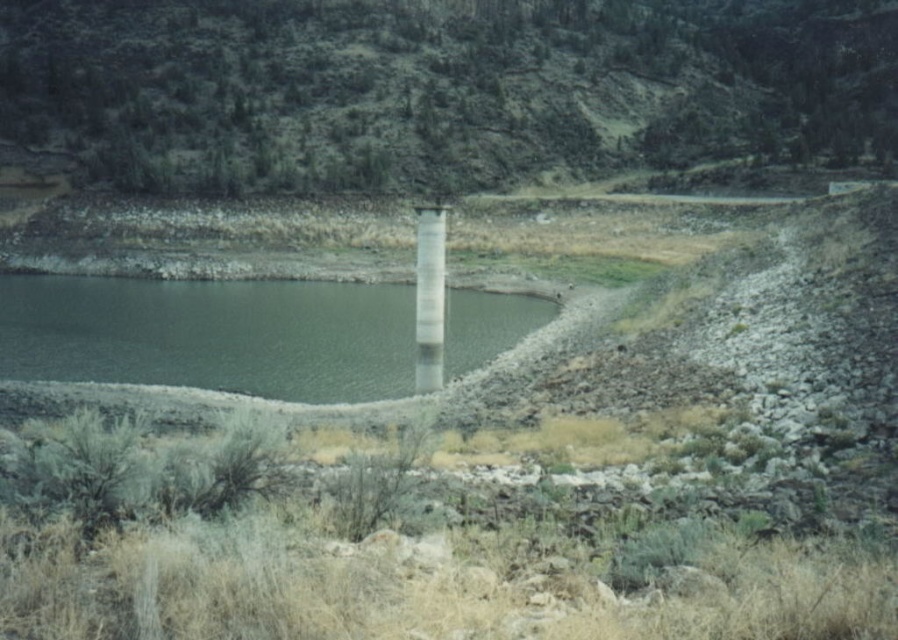
Which is in front, point (674, 45) or point (465, 369)?

Point (465, 369)

Is green grassy hillside at upper center positioned behind green concrete water at center left?

Yes, green grassy hillside at upper center is behind green concrete water at center left.

This screenshot has width=898, height=640. In order to click on green grassy hillside at upper center in this screenshot , I will do `click(447, 92)`.

Is green concrete water at center left wider than white glossy pillar at center?

Indeed, green concrete water at center left has a greater width compared to white glossy pillar at center.

Which is in front, point (392, 355) or point (430, 337)?

Point (430, 337) is more forward.

Find the location of a particular element. Image resolution: width=898 pixels, height=640 pixels. green concrete water at center left is located at coordinates (212, 333).

The width and height of the screenshot is (898, 640). What do you see at coordinates (447, 92) in the screenshot?
I see `green grassy hillside at upper center` at bounding box center [447, 92].

Locate an element on the screen. The width and height of the screenshot is (898, 640). green grassy hillside at upper center is located at coordinates (447, 92).

The height and width of the screenshot is (640, 898). Identify the location of green grassy hillside at upper center. (447, 92).